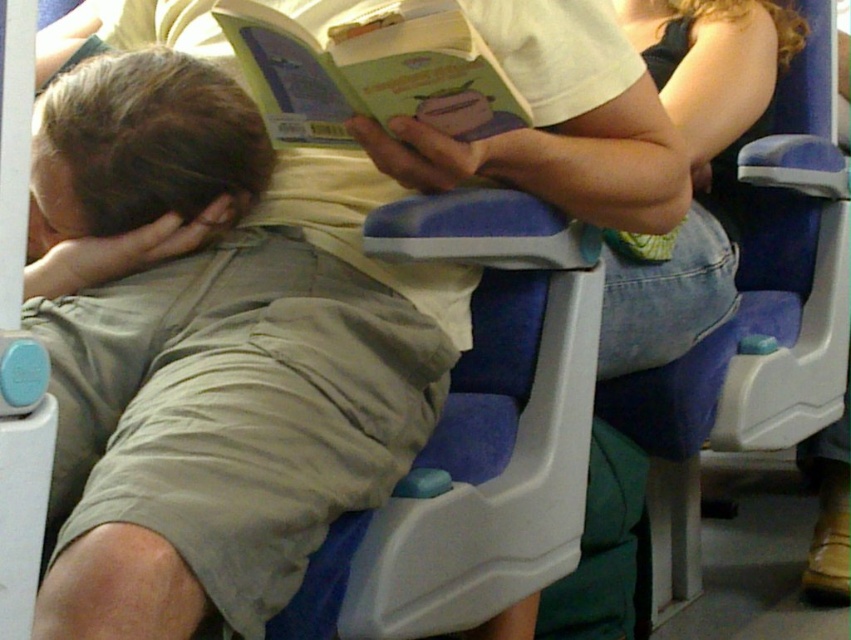
Who is more distant from viewer, (x=187, y=150) or (x=375, y=32)?

The point (x=187, y=150) is more distant.

At what (x,y) coordinates should I click in order to perform the action: click on brown matte hair at center. Please return your answer as a coordinate pair (x, y). Looking at the image, I should click on (152, 138).

In the scene shown: Measure the distance between brown matte hair at center and camera.

34.92 inches

You are a GUI agent. You are given a task and a screenshot of the screen. Output one action in this format:
    pyautogui.click(x=<x>, y=<y>)
    Task: Click on the brown matte hair at center
    Image resolution: width=851 pixels, height=640 pixels.
    Given the screenshot: What is the action you would take?
    pyautogui.click(x=152, y=138)